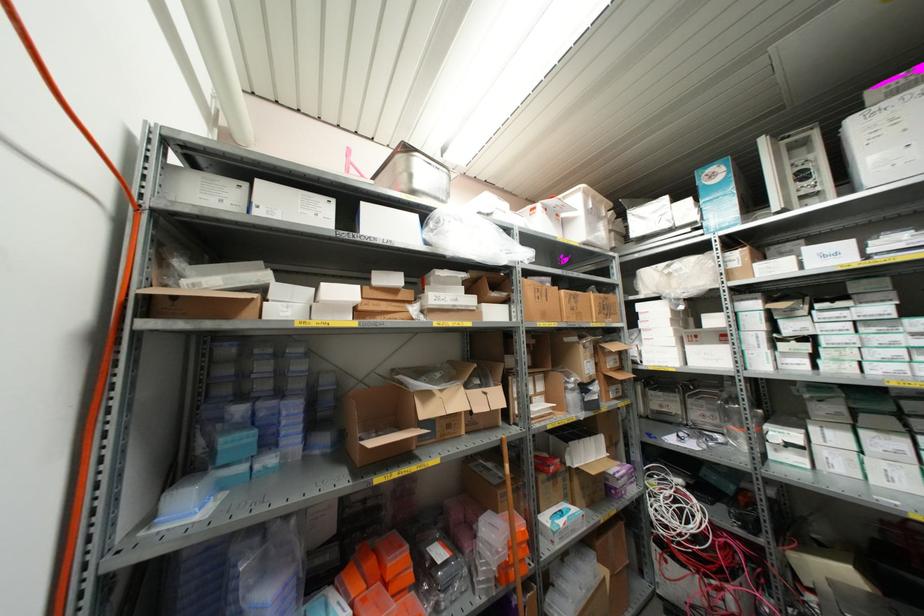
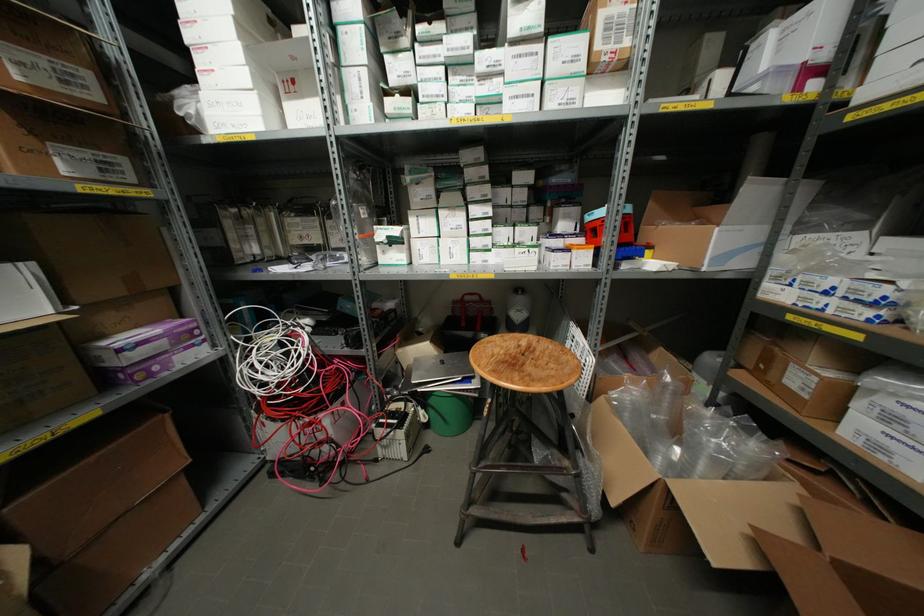
Where in the second image is the point corresponding to the point at 639,325 from the first image?

(188, 36)